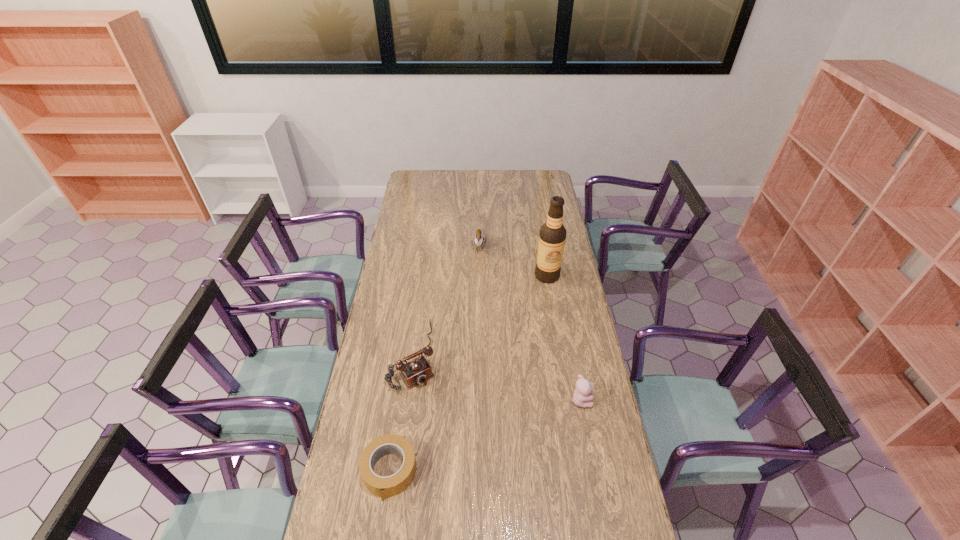
Find the location of a particular element. blank space that satisfies the following two spatial constraints: 1. on the front side of the teddy bear; 2. at the face of the telephone is located at coordinates (408, 400).

Where is `free space that satisfies the following two spatial constraints: 1. on the front side of the teddy bear; 2. at the face of the farthest object`? free space that satisfies the following two spatial constraints: 1. on the front side of the teddy bear; 2. at the face of the farthest object is located at coordinates (479, 400).

This screenshot has width=960, height=540. What are the coordinates of `free spot that satisfies the following two spatial constraints: 1. on the front side of the teddy bear; 2. at the face of the farthest object` in the screenshot? It's located at (479, 400).